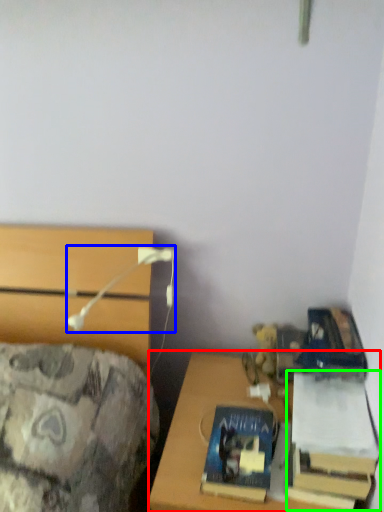
Question: Which object is the closest to the desk (highlighted by a red box)? Choose among these: table lamp (highlighted by a blue box) or book (highlighted by a green box).

Choices:
 (A) table lamp
 (B) book

Answer: (B)